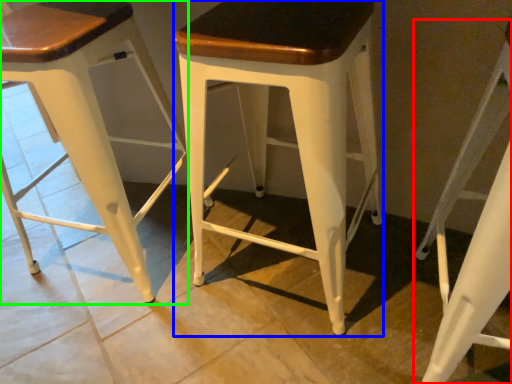
Question: Which object is positioned closest to stool (highlighted by a red box)? Select from stool (highlighted by a blue box) and stool (highlighted by a green box).

Choices:
 (A) stool
 (B) stool

Answer: (A)